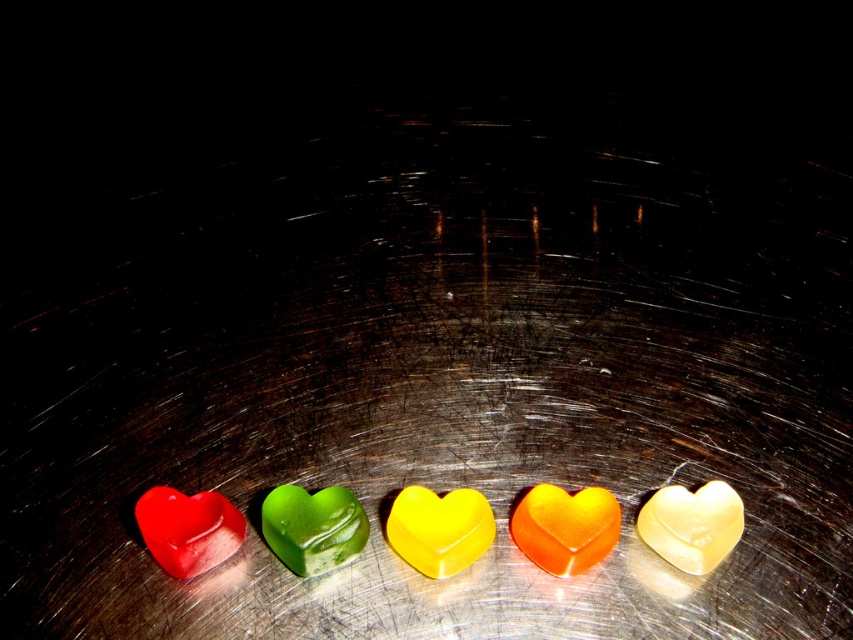
Is the position of yellow translucent heart at center more distant than that of translucent yellow heart at center?

That is True.

Does yellow translucent heart at center have a lesser height compared to translucent yellow heart at center?

Indeed, yellow translucent heart at center has a lesser height compared to translucent yellow heart at center.

Does point (451, 570) come farther from viewer compared to point (650, 525)?

Yes.

Locate an element on the screen. The width and height of the screenshot is (853, 640). yellow translucent heart at center is located at coordinates (439, 529).

Who is more distant from viewer, (x=537, y=554) or (x=445, y=531)?

Positioned behind is point (x=537, y=554).

Which is more to the left, translucent orange heart at center or yellow translucent heart at center?

From the viewer's perspective, yellow translucent heart at center appears more on the left side.

Between point (534, 513) and point (415, 502), which one is positioned in front?

Point (534, 513)

I want to click on translucent orange heart at center, so click(x=566, y=528).

Which is behind, point (175, 504) or point (683, 529)?

The point (175, 504) is behind.

Measure the distance between matte translucent heart at left and camera.

matte translucent heart at left and camera are 3.77 feet apart from each other.

Between point (202, 512) and point (704, 508), which one is positioned in front?

Positioned in front is point (704, 508).

I want to click on matte translucent heart at left, so click(x=189, y=529).